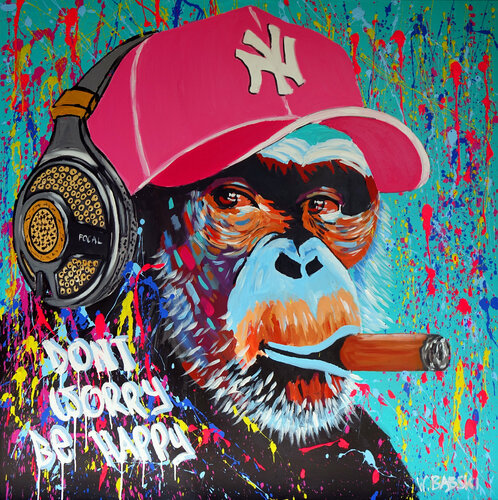
Where is `band of headphones that goes over head`? The height and width of the screenshot is (500, 498). band of headphones that goes over head is located at coordinates (98, 74).